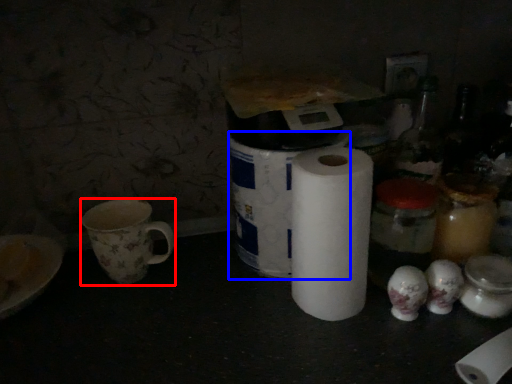
Question: Which point is further to the camera, coffee cup (highlighted by a red box) or toilet paper (highlighted by a blue box)?

Choices:
 (A) coffee cup
 (B) toilet paper

Answer: (A)